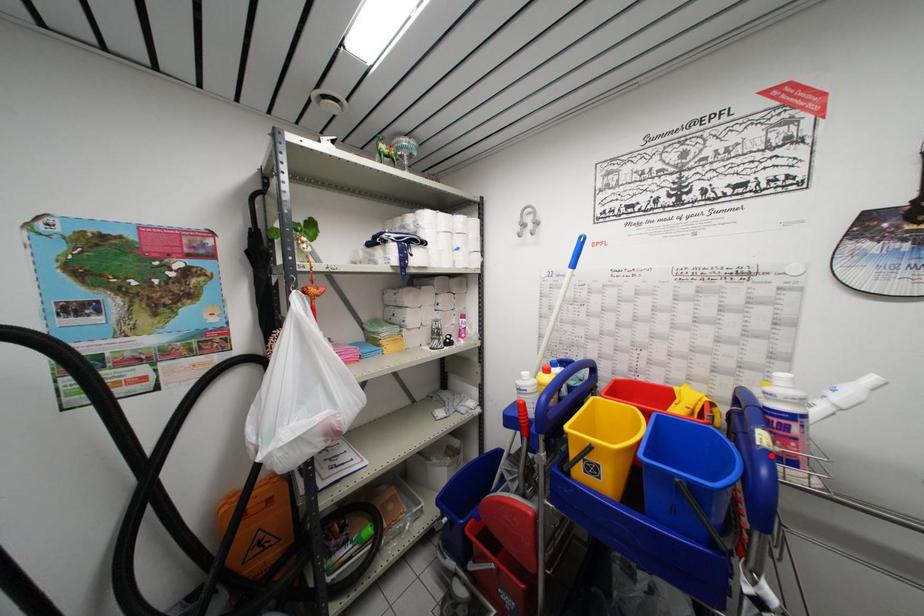
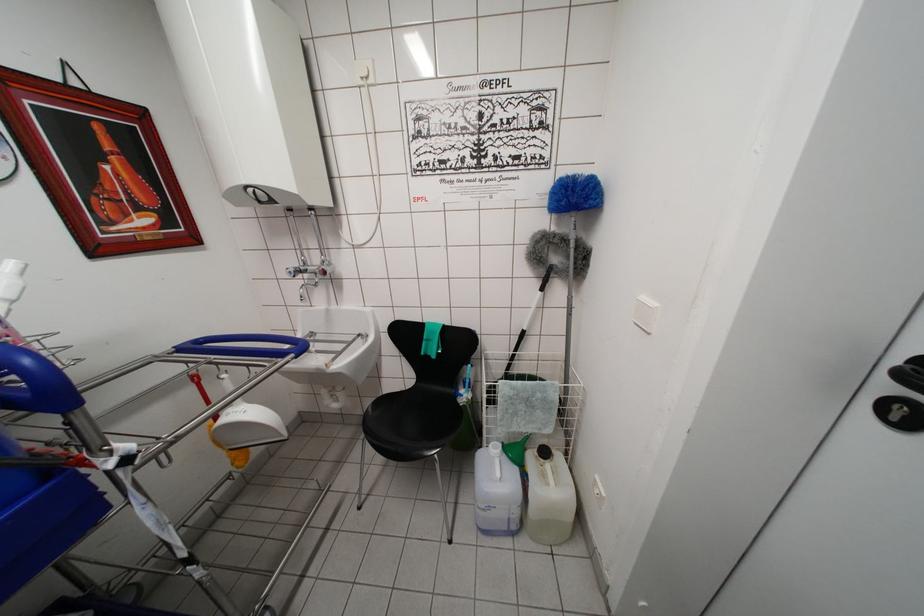
Find the pixel in the second image that matches the highlighted location in the first image.

(5, 349)